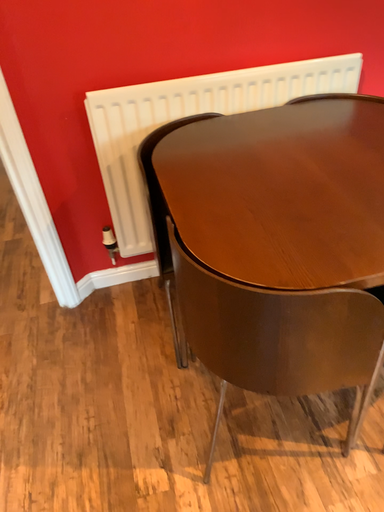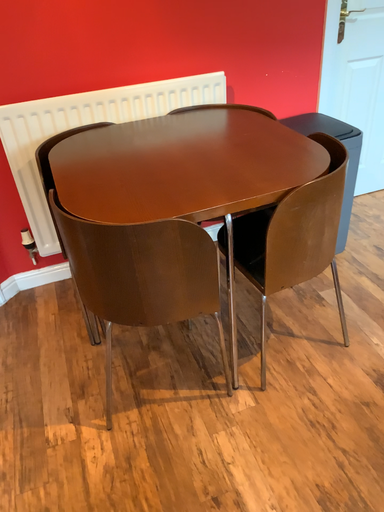
Question: Which way did the camera rotate in the video?

Choices:
 (A) rotated upward
 (B) rotated downward

Answer: (A)